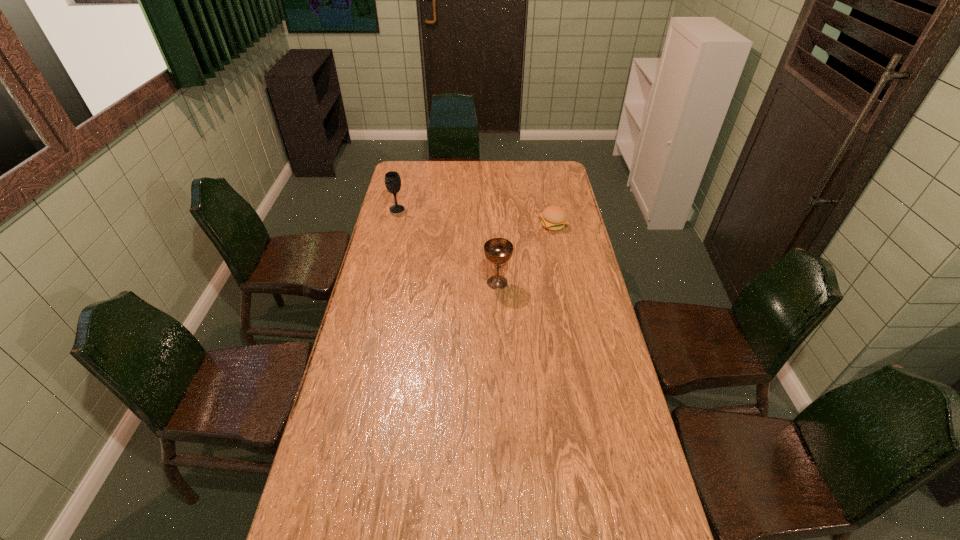
Locate an element on the screen. This screenshot has width=960, height=540. object located in the right edge section of the desktop is located at coordinates (554, 218).

Locate an element on the screen. free space at the far edge of the desktop is located at coordinates (466, 179).

I want to click on vacant space at the left edge of the desktop, so click(x=383, y=272).

Identify the location of free location at the right edge. (588, 276).

Where is `free space at the far left corner`? free space at the far left corner is located at coordinates (401, 160).

Where is `vacant space in between the nearest object and the second farthest object`? vacant space in between the nearest object and the second farthest object is located at coordinates (525, 254).

Find the location of a particular element. free space that is in between the hamburger and the nearest object is located at coordinates (525, 254).

The height and width of the screenshot is (540, 960). Find the location of `vacant point located between the farthest object and the rightmost object`. vacant point located between the farthest object and the rightmost object is located at coordinates (475, 217).

Find the location of a particular element. vacant space that's between the hamburger and the farthest object is located at coordinates (475, 217).

This screenshot has width=960, height=540. I want to click on vacant region between the second nearest object and the leftmost object, so click(x=475, y=217).